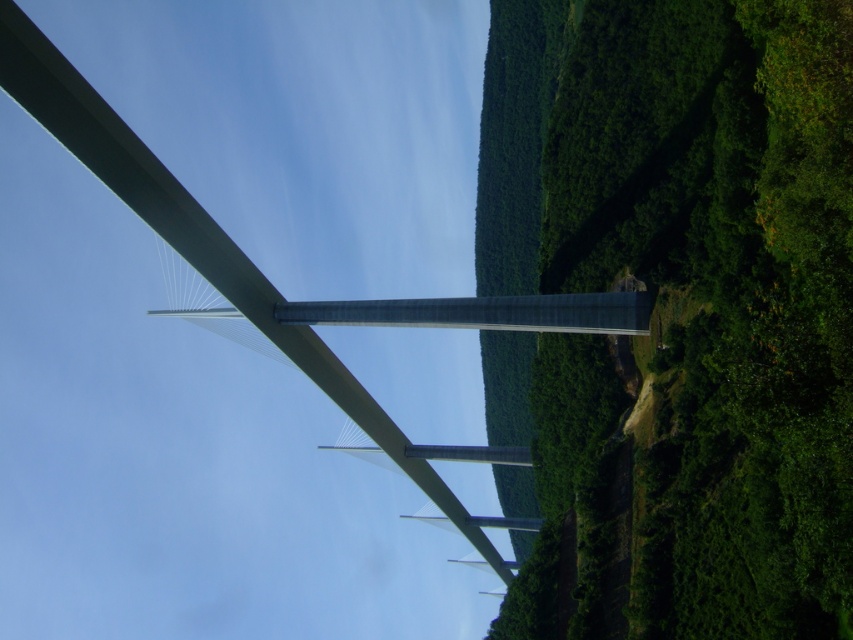
Question: Where is green leafy tree at right located in relation to metallic gray bridge at center in the image?

Choices:
 (A) right
 (B) left

Answer: (A)

Question: Which object appears farthest from the camera in this image?

Choices:
 (A) green leafy tree at right
 (B) metallic gray bridge at center

Answer: (B)

Question: In this image, where is green leafy tree at right located relative to metallic gray bridge at center?

Choices:
 (A) right
 (B) left

Answer: (A)

Question: Is green leafy tree at right to the right of metallic gray bridge at center from the viewer's perspective?

Choices:
 (A) no
 (B) yes

Answer: (B)

Question: Which object appears farthest from the camera in this image?

Choices:
 (A) metallic gray bridge at center
 (B) green leafy tree at right

Answer: (A)

Question: Which of the following is the farthest from the observer?

Choices:
 (A) metallic gray bridge at center
 (B) green leafy tree at right

Answer: (A)